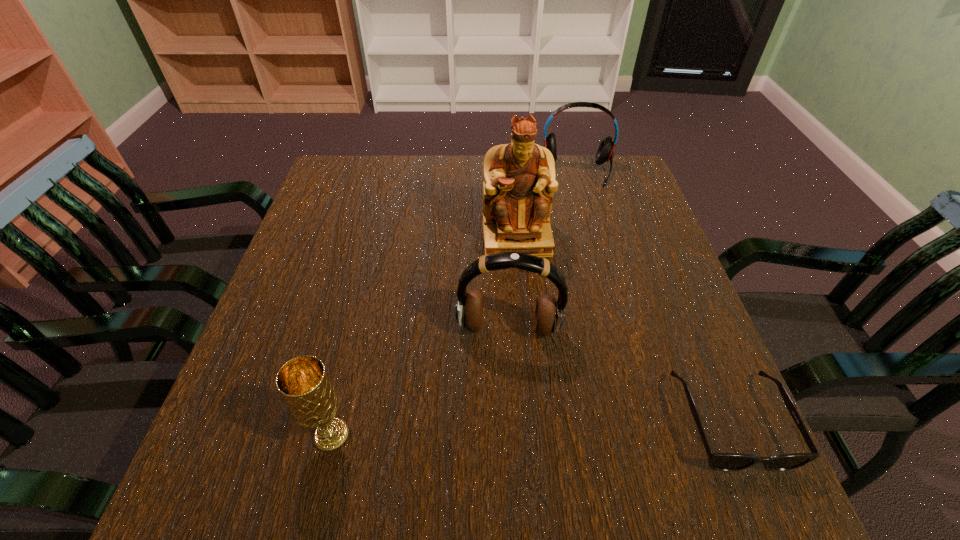
You are a GUI agent. You are given a task and a screenshot of the screen. Output one action in this format:
    pyautogui.click(x=<x>, y=<y>)
    Task: Click on the vacant space on the desktop that is between the leftmost object and the shortest object and is positioned with the microphone attached to the side of the farther headset
    This screenshot has width=960, height=540.
    Given the screenshot: What is the action you would take?
    pyautogui.click(x=587, y=426)

Image resolution: width=960 pixels, height=540 pixels. What are the coordinates of `free space on the desktop that is between the leftmost object and the sunglasses and is positioned on the front-facing side of the tallest object` in the screenshot? It's located at (539, 428).

Locate an element on the screen. The width and height of the screenshot is (960, 540). free space on the desktop that is between the leftmost object and the sunglasses and is positioned on the ear cup of the left headset is located at coordinates (504, 429).